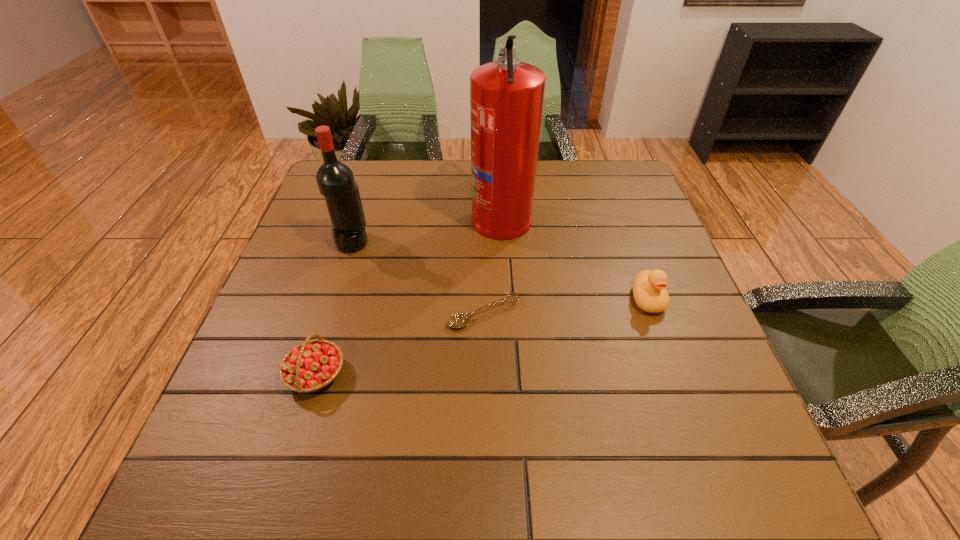
I want to click on vacant space at the far right corner of the desktop, so click(x=626, y=161).

Find the location of a particular element. empty space that is in between the rightmost object and the strawberry is located at coordinates (482, 337).

Locate an element on the screen. The image size is (960, 540). vacant area that lies between the second tallest object and the nearest object is located at coordinates (334, 308).

Locate an element on the screen. The height and width of the screenshot is (540, 960). vacant space that is in between the duck and the strawberry is located at coordinates (482, 337).

Find the location of `vacant space in between the ladle and the rightmost object`. vacant space in between the ladle and the rightmost object is located at coordinates (565, 306).

Where is `empty location between the second tallest object and the strawberry`? The image size is (960, 540). empty location between the second tallest object and the strawberry is located at coordinates (334, 308).

Image resolution: width=960 pixels, height=540 pixels. I want to click on vacant area between the wine bottle and the ladle, so click(x=419, y=278).

Identify the location of vacant area between the shortest object and the nearest object. (400, 344).

Where is `free area in between the fourth shortest object and the duck`? free area in between the fourth shortest object and the duck is located at coordinates (500, 271).

The image size is (960, 540). What are the coordinates of `vacant space that's between the wine bottle and the nearest object` in the screenshot? It's located at (334, 308).